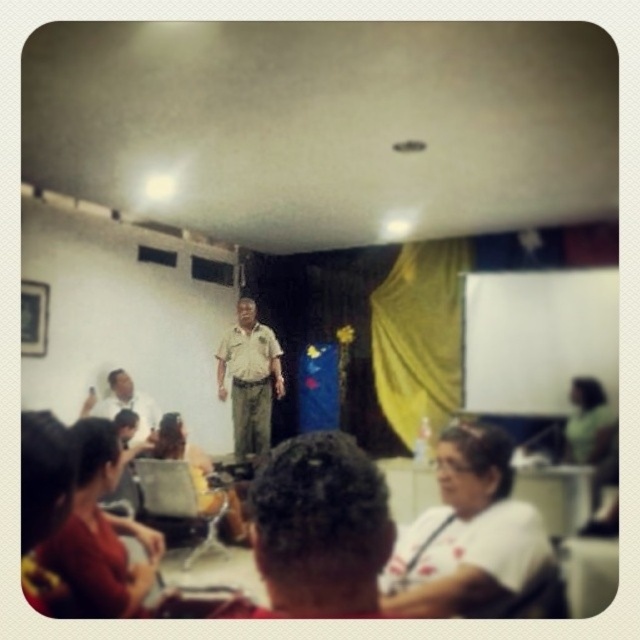
Which is behind, point (90, 586) or point (113, 400)?

Positioned behind is point (113, 400).

How distant is matte khaki uniform at lower left from white cotton shirt at center?

matte khaki uniform at lower left and white cotton shirt at center are 3.57 meters apart from each other.

Is point (74, 573) closer to viewer compared to point (88, 401)?

Yes, point (74, 573) is in front of point (88, 401).

Where is `matte khaki uniform at lower left`? The height and width of the screenshot is (640, 640). matte khaki uniform at lower left is located at coordinates (90, 563).

Can you confirm if white matte shirt at lower center is thinner than white cotton shirt at center?

No.

Can you confirm if white matte shirt at lower center is positioned above white cotton shirt at center?

Yes, white matte shirt at lower center is above white cotton shirt at center.

I want to click on white matte shirt at lower center, so click(465, 561).

Which is more to the right, khaki uniform at center or matte khaki uniform at lower left?

matte khaki uniform at lower left is more to the right.

Can you confirm if khaki uniform at center is shorter than matte khaki uniform at lower left?

In fact, khaki uniform at center may be taller than matte khaki uniform at lower left.

Identify the location of khaki uniform at center. This screenshot has width=640, height=640. (250, 378).